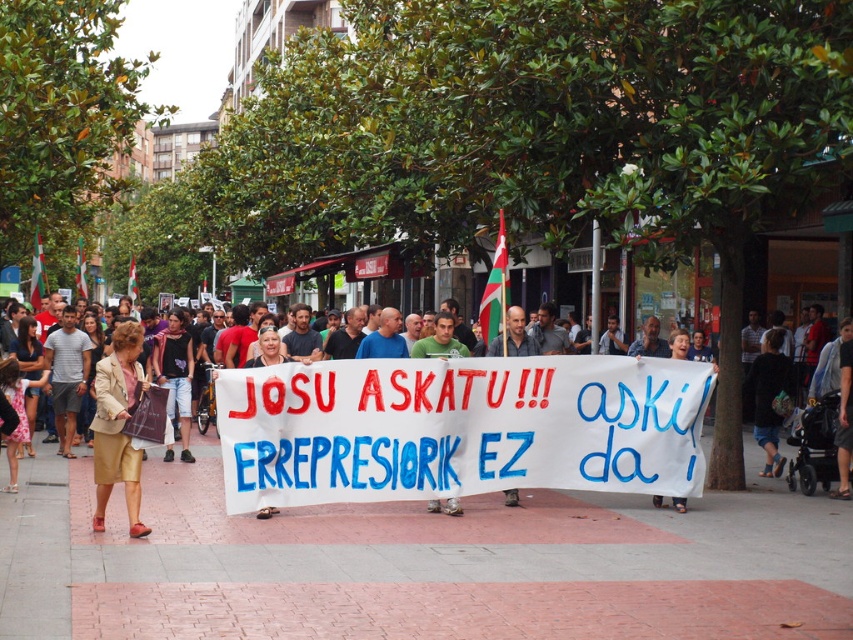
You are a photographer trying to capture the protest scene. You notice two points of interest marked at coordinates point (575,596) and point (119,369). If you want to focus on the closer point to the camera, which coordinate should you aim for?

Point (575,596) is in front of point (119,369), so you should aim for point (575,596) to focus on the closer one.

You are a photographer standing on the sidewalk and want to take a photo of the white fabric banner at center and the gold fabric skirt at lower left. Which object is positioned lower in the frame?

The white fabric banner at center is located below the gold fabric skirt at lower left, so it is positioned lower in the frame.

You are a photographer trying to capture the entire white fabric banner at center and the gray concrete pavement at center in one frame. Based on their positions, which object should you focus on first to ensure both are in the shot?

The gray concrete pavement at center is positioned on the left side of white fabric banner at center, so you should focus on the white fabric banner at center first to ensure both are in the frame.